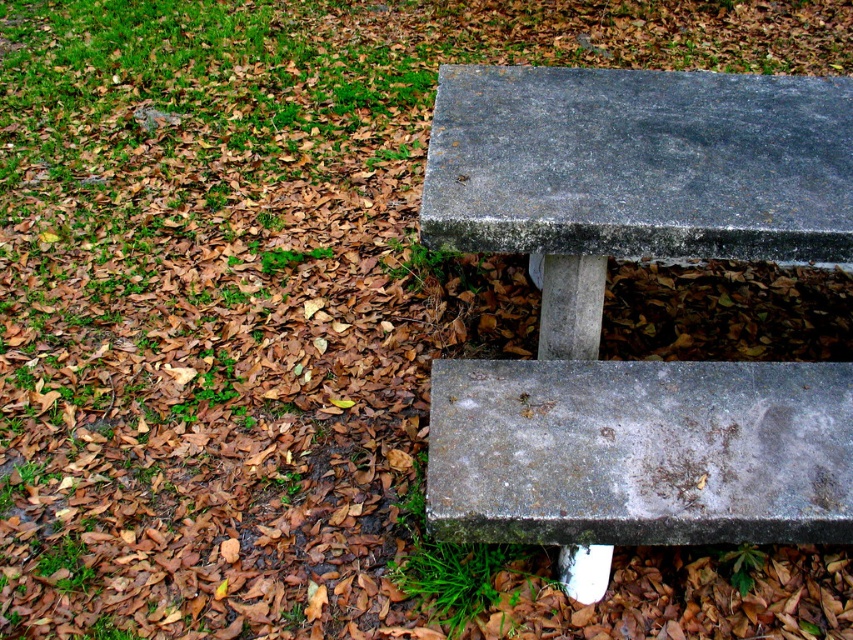
You are a gardener who wants to place a new decorative pot between the gray concrete bench at center and the gray concrete bench at lower right. The pot is 10 inches wide. Based on the scene description, will the pot fit between the two benches?

The distance between the gray concrete bench at center and the gray concrete bench at lower right is 8.31 inches. Since the pot is 10 inches wide, it will not fit between them as the space is narrower than the pot.

You are standing in a park and see the point marked at coordinates (602, 301). What object is located at that point?

The point at coordinates (602, 301) indicates the gray concrete bench at center.

You are a painter standing on the ground covered with fallen leaves. You want to paint both the gray concrete bench at upper center and the gray concrete bench at lower right. Which bench should you stand closer to in order to paint both accurately?

You should stand closer to the gray concrete bench at lower right because it is shorter than the gray concrete bench at upper center, allowing you to reach both by adjusting your position accordingly.